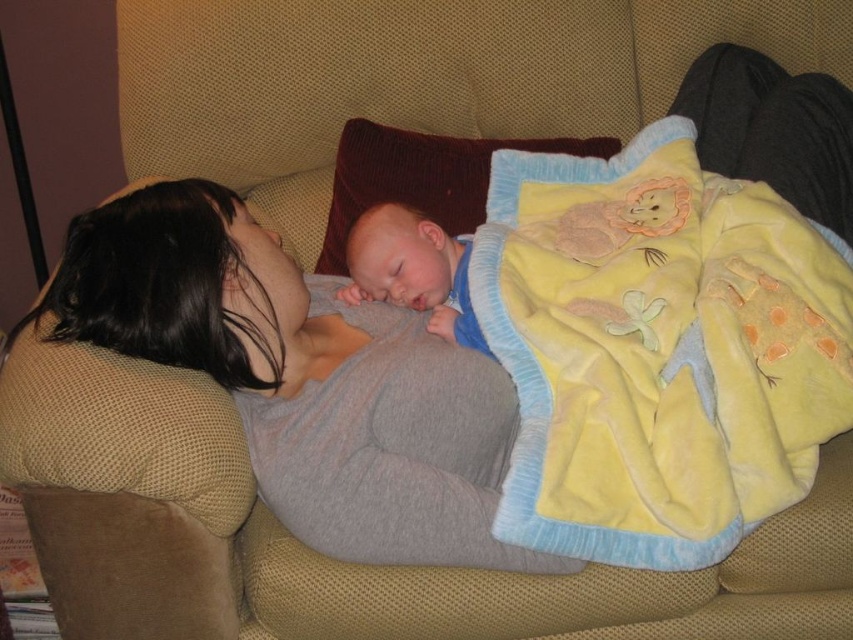
Question: Considering the relative positions of gray soft fabric at center and brown fuzzy pillow at upper center in the image provided, where is gray soft fabric at center located with respect to brown fuzzy pillow at upper center?

Choices:
 (A) above
 (B) below

Answer: (B)

Question: Is brown fuzzy pillow at upper center to the right of soft blue fabric at center from the viewer's perspective?

Choices:
 (A) yes
 (B) no

Answer: (A)

Question: Is gray soft fabric at center positioned before soft blue fabric at center?

Choices:
 (A) yes
 (B) no

Answer: (A)

Question: Which object appears closest to the camera in this image?

Choices:
 (A) soft blue fabric at center
 (B) gray soft fabric at center

Answer: (B)

Question: Estimate the real-world distances between objects in this image. Which object is farther from the brown fuzzy pillow at upper center?

Choices:
 (A) gray soft fabric at center
 (B) yellow fleece blanket at lower right
 (C) soft blue fabric at center

Answer: (B)

Question: Which point is farther to the camera?

Choices:
 (A) (161, 250)
 (B) (460, 273)
 (C) (326, 272)

Answer: (C)